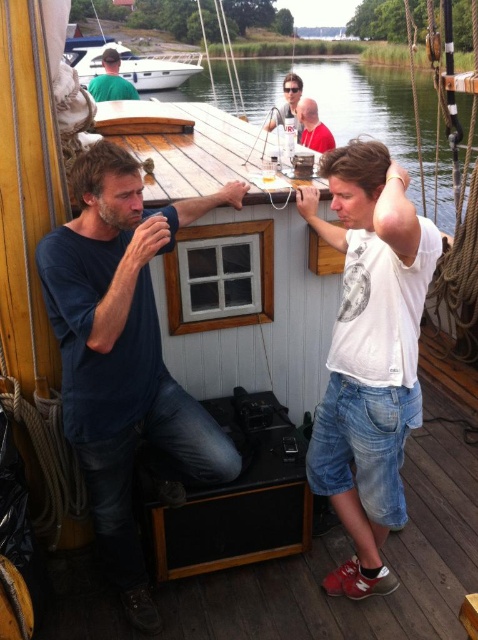
The width and height of the screenshot is (478, 640). What do you see at coordinates (369, 353) in the screenshot?
I see `white cotton t-shirt at center` at bounding box center [369, 353].

Looking at this image, is white cotton t-shirt at center shorter than wooden table at center?

Yes, white cotton t-shirt at center is shorter than wooden table at center.

The height and width of the screenshot is (640, 478). What do you see at coordinates (369, 353) in the screenshot?
I see `white cotton t-shirt at center` at bounding box center [369, 353].

Locate an element on the screen. The image size is (478, 640). white cotton t-shirt at center is located at coordinates (369, 353).

Can you confirm if blue cotton shirt at left is bigger than wooden table at center?

Actually, blue cotton shirt at left might be smaller than wooden table at center.

Which is more to the right, blue cotton shirt at left or wooden table at center?

wooden table at center

Identify the location of blue cotton shirt at left. This screenshot has height=640, width=478. (123, 353).

Is white glossy boat at upper center further to the viewer compared to green matte shirt at upper left?

That is True.

Who is more forward, (156, 90) or (108, 96)?

Point (108, 96) is more forward.

Is point (67, 60) more distant than point (126, 88)?

Yes, it is behind point (126, 88).

This screenshot has height=640, width=478. In order to click on white glossy boat at upper center in this screenshot , I will do `click(130, 64)`.